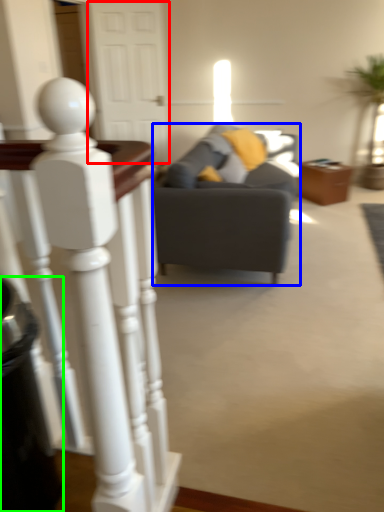
Question: Which is nearer to the glass door (highlighted by a red box)? studio couch (highlighted by a blue box) or trash bin/can (highlighted by a green box).

Choices:
 (A) studio couch
 (B) trash bin/can

Answer: (A)